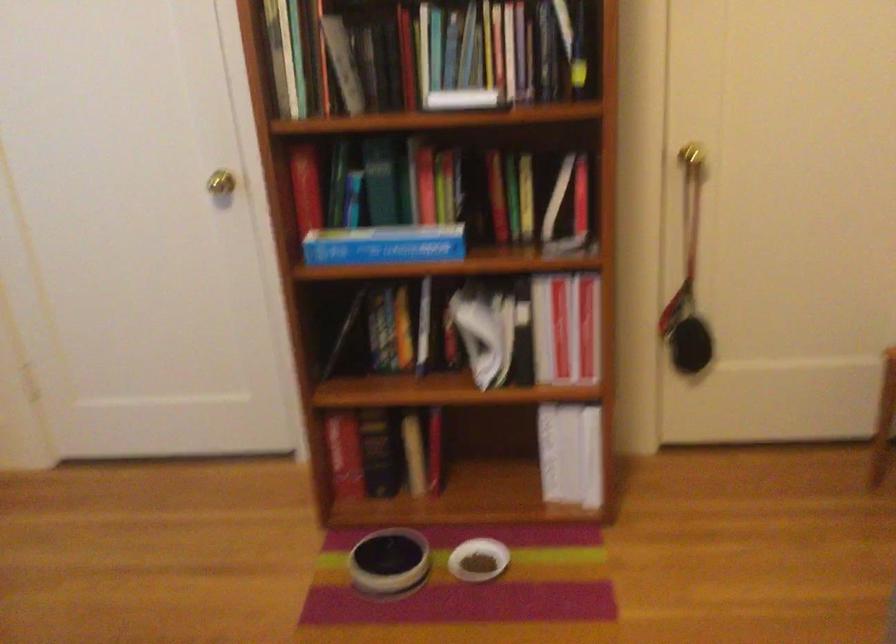
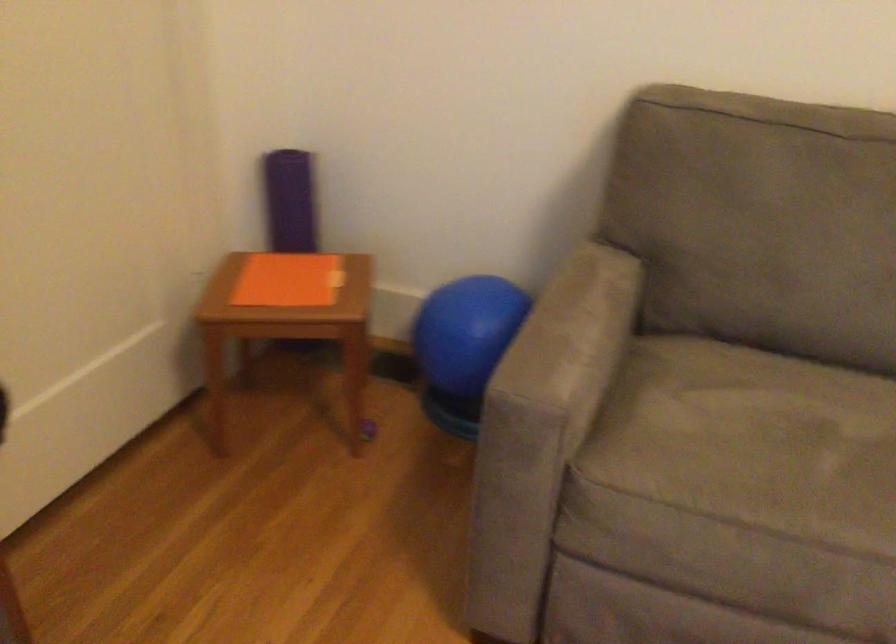
Question: The images are taken continuously from a first-person perspective. In which direction is your viewpoint rotating?

Choices:
 (A) Left
 (B) Right
 (C) Up
 (D) Down

Answer: (B)